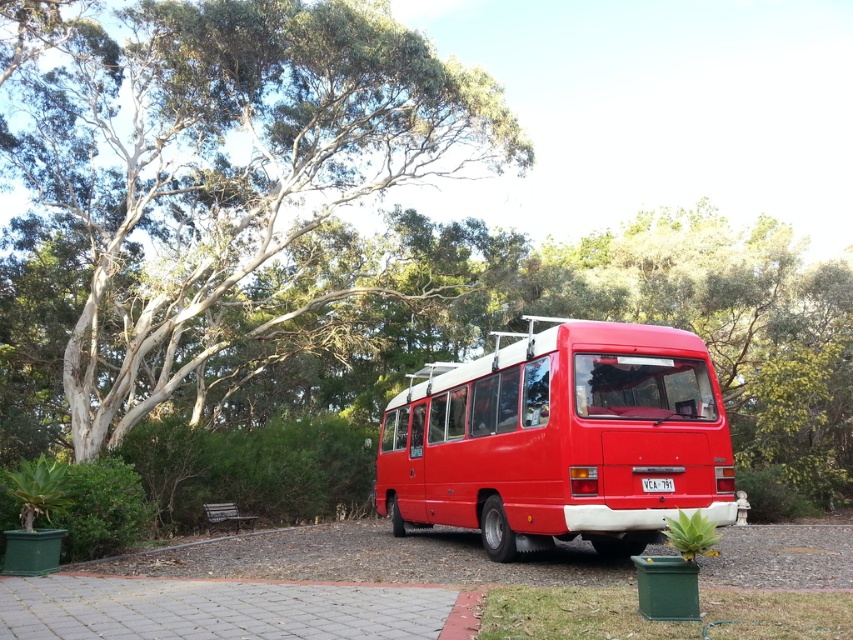
You are standing in the park where the red van is parked. You want to take a photo of the van with the smooth bark tree at upper left in the background. Where should you position yourself relative to the van to ensure the tree is visible in the background?

To capture the smooth bark tree at upper left in the background of the van, position yourself to the left side of the van since the tree is located at point (234,179), which is towards the upper left quadrant of the image frame.

You are a delivery driver who needs to park your truck between the smooth bark tree at upper left and the shiny red bus at center. The truck requires 40 feet of space. Is there enough space between them?

The distance between the smooth bark tree at upper left and the shiny red bus at center is 42.14 feet, which is more than the required 40 feet. Therefore, there is sufficient space to park the truck between them.

You are standing in the park and see the red van parked on the gravel surface. There is a point marked at coordinates (234, 179). What is located at that point?

The point at coordinates (234, 179) indicates a smooth bark tree at upper left.